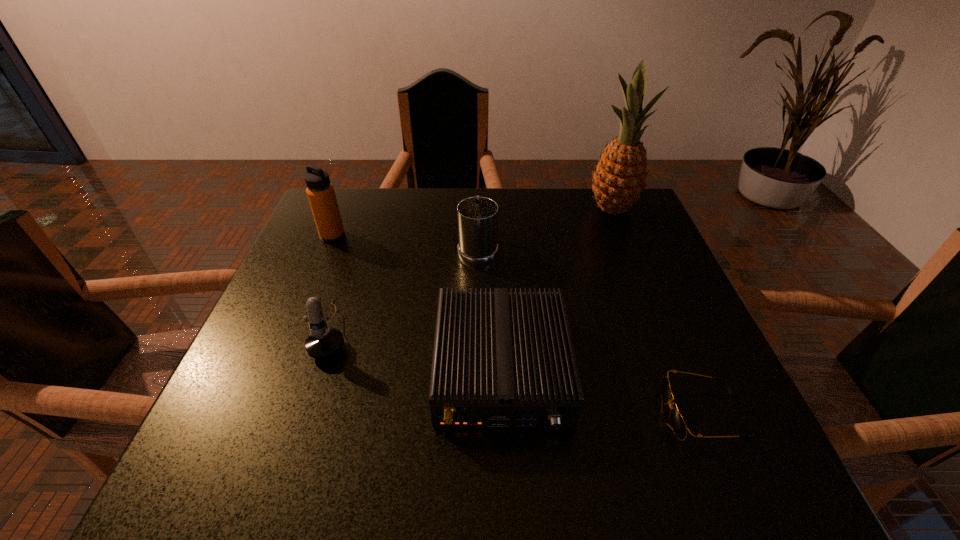
Locate an element on the screen. the farthest object is located at coordinates 619,179.

Locate an element on the screen. Image resolution: width=960 pixels, height=540 pixels. pineapple is located at coordinates (619, 179).

Where is `the fifth shortest object`? This screenshot has width=960, height=540. the fifth shortest object is located at coordinates (320, 192).

This screenshot has width=960, height=540. Identify the location of thermos bottle. (320, 192).

Image resolution: width=960 pixels, height=540 pixels. Identify the location of mug. (477, 216).

Find the location of a particular element. Image resolution: width=960 pixels, height=540 pixels. microphone is located at coordinates (324, 342).

Locate an element on the screen. the second shortest object is located at coordinates (501, 359).

Identify the location of sunglasses. (678, 424).

What are the coordinates of `free space located 0.340m on the left of the pineapple` in the screenshot? It's located at (465, 208).

You are a GUI agent. You are given a task and a screenshot of the screen. Output one action in this format:
    pyautogui.click(x=<x>, y=<y>)
    Task: Click on the vacant space located on the right of the thermos bottle
    
    Given the screenshot: What is the action you would take?
    pyautogui.click(x=379, y=235)